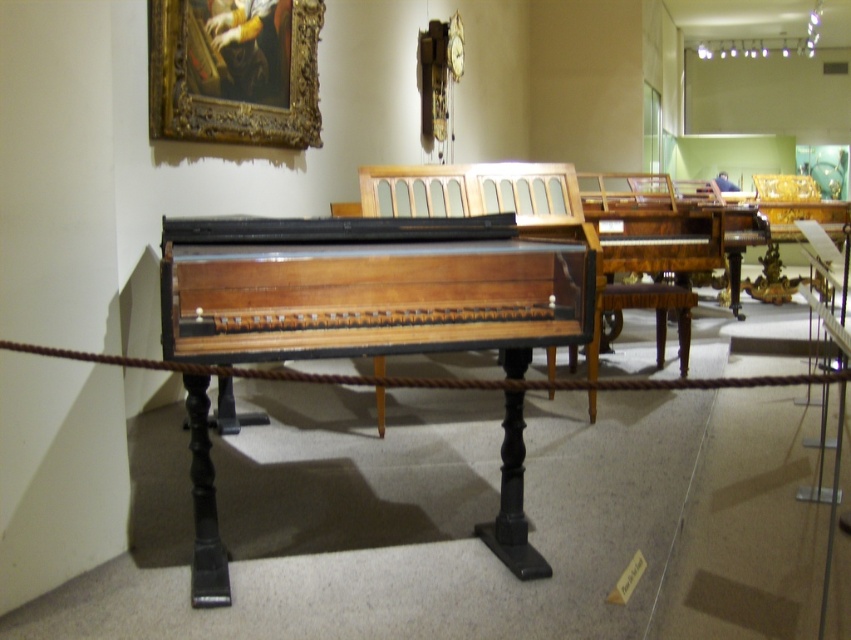
You are a museum visitor who wants to take a photo of the wooden polished piano at center without any obstructions. The gold ornate frame at upper left is blocking your view. Can you move closer to the piano to ensure the frame doesn

The distance between the wooden polished piano at center and the gold ornate frame at upper left is 7.26 feet. Since the frame is blocking your view, moving closer to the piano would bring you closer to the frame, potentially increasing obstruction. To avoid the frame, you should move to the side or adjust your angle instead of moving forward.

You are a museum visitor who wants to take a photo of the wooden polished piano at center. The museum requires visitors to stay at least 6 feet away from the exhibits. Are you within the allowed distance?

The wooden polished piano at center and viewer are 6.72 feet apart from each other, which is more than the required 6 feet distance. Therefore, you are within the allowed distance and can take the photo.

You are standing in front of the harpsichord and want to take a photo. There are two points marked in the scene, point 1 at coordinates (x=267, y=269) and point 2 at (x=233, y=17). Which point should you focus on to ensure the closer one to the camera is in sharp focus?

Point 1 at coordinates (x=267, y=269) is closer to the camera than point 2 at (x=233, y=17), so you should focus on point 1 to ensure the closer one is in sharp focus.